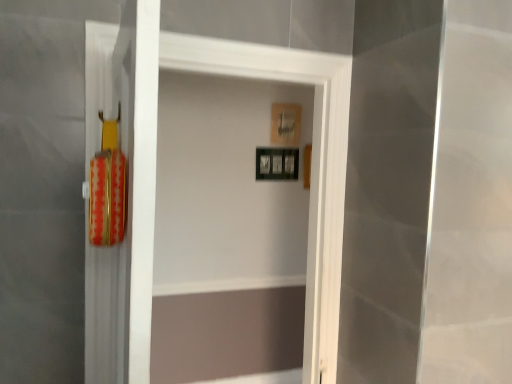
Question: Does black matte picture frame at center, which appears as the first picture frame when ordered from the bottom, contain wooden picture frame at upper center, which appears as the second picture frame when ordered from the bottom?

Choices:
 (A) yes
 (B) no

Answer: (B)

Question: From a real-world perspective, is black matte picture frame at center, which appears as the first picture frame when ordered from the bottom, over wooden picture frame at upper center, marked as the first picture frame in a top-to-bottom arrangement?

Choices:
 (A) no
 (B) yes

Answer: (A)

Question: Is black matte picture frame at center, arranged as the 2th picture frame when viewed from the top, further to camera compared to wooden picture frame at upper center, marked as the first picture frame in a top-to-bottom arrangement?

Choices:
 (A) yes
 (B) no

Answer: (B)

Question: Does black matte picture frame at center, which appears as the first picture frame when ordered from the bottom, have a larger size compared to wooden picture frame at upper center, marked as the first picture frame in a top-to-bottom arrangement?

Choices:
 (A) yes
 (B) no

Answer: (A)

Question: Can you confirm if black matte picture frame at center, which appears as the first picture frame when ordered from the bottom, is positioned to the left of wooden picture frame at upper center, marked as the first picture frame in a top-to-bottom arrangement?

Choices:
 (A) no
 (B) yes

Answer: (B)

Question: Considering the relative sizes of black matte picture frame at center, which appears as the first picture frame when ordered from the bottom, and wooden picture frame at upper center, which appears as the second picture frame when ordered from the bottom, in the image provided, is black matte picture frame at center, which appears as the first picture frame when ordered from the bottom, taller than wooden picture frame at upper center, which appears as the second picture frame when ordered from the bottom,?

Choices:
 (A) yes
 (B) no

Answer: (B)

Question: Considering the relative positions of wooden picture frame at upper center, which appears as the second picture frame when ordered from the bottom, and black matte picture frame at center, arranged as the 2th picture frame when viewed from the top, in the image provided, is wooden picture frame at upper center, which appears as the second picture frame when ordered from the bottom, to the left of black matte picture frame at center, arranged as the 2th picture frame when viewed from the top, from the viewer's perspective?

Choices:
 (A) no
 (B) yes

Answer: (A)

Question: Is wooden picture frame at upper center, marked as the first picture frame in a top-to-bottom arrangement, far away from black matte picture frame at center, arranged as the 2th picture frame when viewed from the top?

Choices:
 (A) yes
 (B) no

Answer: (B)

Question: Is wooden picture frame at upper center, which appears as the second picture frame when ordered from the bottom, taller than black matte picture frame at center, which appears as the first picture frame when ordered from the bottom?

Choices:
 (A) no
 (B) yes

Answer: (B)

Question: Does wooden picture frame at upper center, which appears as the second picture frame when ordered from the bottom, have a larger size compared to black matte picture frame at center, which appears as the first picture frame when ordered from the bottom?

Choices:
 (A) yes
 (B) no

Answer: (B)

Question: Is wooden picture frame at upper center, marked as the first picture frame in a top-to-bottom arrangement, wider than black matte picture frame at center, arranged as the 2th picture frame when viewed from the top?

Choices:
 (A) no
 (B) yes

Answer: (A)

Question: Does wooden picture frame at upper center, which appears as the second picture frame when ordered from the bottom, have a smaller size compared to black matte picture frame at center, which appears as the first picture frame when ordered from the bottom?

Choices:
 (A) yes
 (B) no

Answer: (A)

Question: Is wooden picture frame at upper center, which appears as the second picture frame when ordered from the bottom, bigger or smaller than black matte picture frame at center, which appears as the first picture frame when ordered from the bottom?

Choices:
 (A) small
 (B) big

Answer: (A)